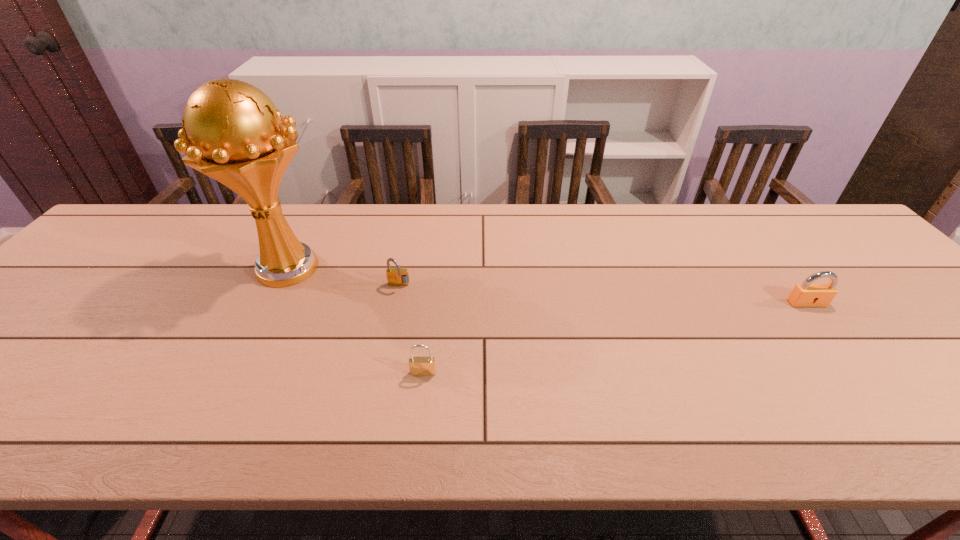
Locate an element on the screen. Image resolution: width=960 pixels, height=540 pixels. vacant space located 0.340m on the side with the combination dials of the leftmost padlock is located at coordinates (373, 408).

Find the location of a particular element. The height and width of the screenshot is (540, 960). vacant space situated 0.080m on the front-facing side of the nearest padlock is located at coordinates (419, 410).

The image size is (960, 540). What are the coordinates of `object present at the far edge` in the screenshot? It's located at (232, 132).

At what (x,y) coordinates should I click in order to perform the action: click on blank space at the far edge of the desktop. Please return your answer as a coordinate pair (x, y). Looking at the image, I should click on (671, 211).

At what (x,y) coordinates should I click in order to perform the action: click on vacant space at the near edge of the desktop. Please return your answer as a coordinate pair (x, y). Looking at the image, I should click on (935, 424).

Find the location of a particular element. free space at the right edge is located at coordinates (858, 273).

What are the coordinates of `free spot between the farthest padlock and the tallest object` in the screenshot? It's located at (343, 278).

Find the location of a particular element. This screenshot has width=960, height=540. free spot between the leftmost object and the leftmost padlock is located at coordinates (343, 278).

This screenshot has height=540, width=960. I want to click on vacant area between the rightmost object and the farthest padlock, so click(x=603, y=295).

Where is `free space between the trophy_cup and the leftmost padlock`? Image resolution: width=960 pixels, height=540 pixels. free space between the trophy_cup and the leftmost padlock is located at coordinates (343, 278).